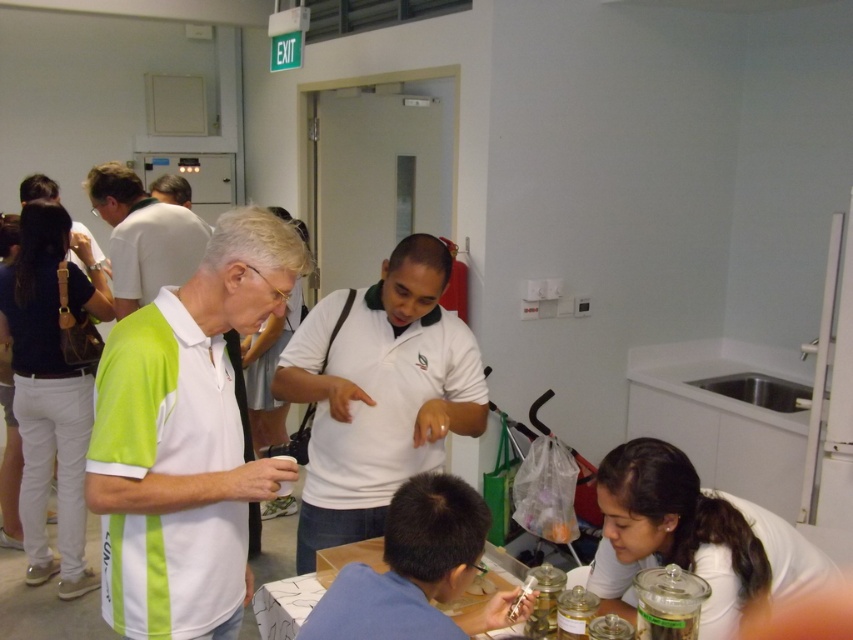
You are standing at the origin point of the coordinate system in the room. You need to locate the white matte polo shirt at center. Which direction should you move to reach it?

The white matte polo shirt at center is located at coordinate point 0.688 on the x axis and 0.219 on the y axis. Since you are at the origin, you should move in the positive x and positive y direction to reach it.

You are a photographer standing at the back of the room. You want to take a photo of the white matte polo shirt at center and the white glossy table at lower center. Which object will appear larger in the photo?

The white matte polo shirt at center will appear larger in the photo because it is much taller than the white glossy table at lower center.

You are standing in the room and see the point marked at coordinates (416, 572). What object or person is located at that point?

The point at coordinates (416, 572) corresponds to the blue fabric shirt at lower center.